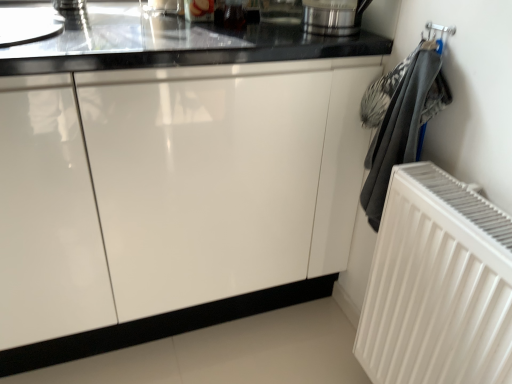
Measure the distance between point (260, 260) and camera.

The depth of point (260, 260) is 1.30 meters.

This screenshot has height=384, width=512. Describe the element at coordinates (333, 16) in the screenshot. I see `polished stainless steel kettle at upper right` at that location.

Identify the location of glossy white cabinet at center. The image size is (512, 384). (201, 195).

From the image's perspective, between white ribbed radiator at right and polished stainless steel kettle at upper right, who is located below?

white ribbed radiator at right, from the image's perspective.

Is white ribbed radiator at right bigger or smaller than polished stainless steel kettle at upper right?

Considering their sizes, white ribbed radiator at right takes up more space than polished stainless steel kettle at upper right.

Which point is more forward, (x=376, y=380) or (x=367, y=3)?

Positioned in front is point (x=376, y=380).

The height and width of the screenshot is (384, 512). What are the coordinates of `radiator below the polished stainless steel kettle at upper right (from the image's perspective)` in the screenshot? It's located at (438, 285).

From the image's perspective, does glossy white cabinet at center appear lower than polished stainless steel kettle at upper right?

Yes.

The height and width of the screenshot is (384, 512). I want to click on cabinetry below the polished stainless steel kettle at upper right (from the image's perspective), so click(x=201, y=195).

Is glossy white cabinet at center oriented towards polished stainless steel kettle at upper right?

No, glossy white cabinet at center is not turned towards polished stainless steel kettle at upper right.

How different are the orientations of glossy white cabinet at center and polished stainless steel kettle at upper right in degrees?

The angle between the facing direction of glossy white cabinet at center and the facing direction of polished stainless steel kettle at upper right is 1.16 degrees.

Is white ribbed radiator at right surrounding glossy white cabinet at center?

No.

From a real-world perspective, who is located higher, white ribbed radiator at right or glossy white cabinet at center?

glossy white cabinet at center, from a real-world perspective.

Consider the image. How many degrees apart are the facing directions of white ribbed radiator at right and glossy white cabinet at center?

They differ by 89.7 degrees in their facing directions.

From the picture: Is white ribbed radiator at right thinner than glossy white cabinet at center?

Yes.

Is polished stainless steel kettle at upper right not close to glossy white cabinet at center?

No, polished stainless steel kettle at upper right is not far away from glossy white cabinet at center.

Considering the positions of point (327, 22) and point (93, 248), is point (327, 22) closer or farther from the camera than point (93, 248)?

Point (327, 22).

The width and height of the screenshot is (512, 384). Find the location of `radiator that is on the right side of glossy white cabinet at center`. radiator that is on the right side of glossy white cabinet at center is located at coordinates (438, 285).

From the image's perspective, which is below, glossy white cabinet at center or white ribbed radiator at right?

white ribbed radiator at right, from the image's perspective.

Is glossy white cabinet at center to the right of white ribbed radiator at right from the viewer's perspective?

In fact, glossy white cabinet at center is to the left of white ribbed radiator at right.

Which object is further away from the camera, polished stainless steel kettle at upper right or white ribbed radiator at right?

polished stainless steel kettle at upper right.

Is polished stainless steel kettle at upper right oriented towards white ribbed radiator at right?

No, polished stainless steel kettle at upper right is not turned towards white ribbed radiator at right.

Is there a large distance between polished stainless steel kettle at upper right and white ribbed radiator at right?

No, polished stainless steel kettle at upper right is not far from white ribbed radiator at right.

Does point (356, 0) come closer to viewer compared to point (486, 317)?

No, (356, 0) is behind (486, 317).

What are the coordinates of `radiator lying below the polished stainless steel kettle at upper right (from the image's perspective)` in the screenshot? It's located at (438, 285).

Where is `appliance that appears above the glossy white cabinet at center (from a real-world perspective)`? appliance that appears above the glossy white cabinet at center (from a real-world perspective) is located at coordinates (333, 16).

When comparing their distances from glossy white cabinet at center, does polished stainless steel kettle at upper right or white ribbed radiator at right seem closer?

white ribbed radiator at right is positioned closer to the anchor glossy white cabinet at center.

In the scene shown: When comparing their distances from polished stainless steel kettle at upper right, does white ribbed radiator at right or glossy white cabinet at center seem further?

white ribbed radiator at right lies further to polished stainless steel kettle at upper right than the other object.

From the picture: Estimate the real-world distances between objects in this image. Which object is closer to white ribbed radiator at right, glossy white cabinet at center or polished stainless steel kettle at upper right?

glossy white cabinet at center is positioned closer to the anchor white ribbed radiator at right.

When comparing their distances from glossy white cabinet at center, does white ribbed radiator at right or polished stainless steel kettle at upper right seem closer?

The object closer to glossy white cabinet at center is white ribbed radiator at right.

Based on their spatial positions, is glossy white cabinet at center or white ribbed radiator at right further from polished stainless steel kettle at upper right?

white ribbed radiator at right is positioned further to the anchor polished stainless steel kettle at upper right.

Looking at this image, considering their positions, is polished stainless steel kettle at upper right positioned closer to white ribbed radiator at right than glossy white cabinet at center?

Among the two, glossy white cabinet at center is located nearer to white ribbed radiator at right.

Locate an element on the screen. cabinetry between polished stainless steel kettle at upper right and white ribbed radiator at right in the vertical direction is located at coordinates (201, 195).